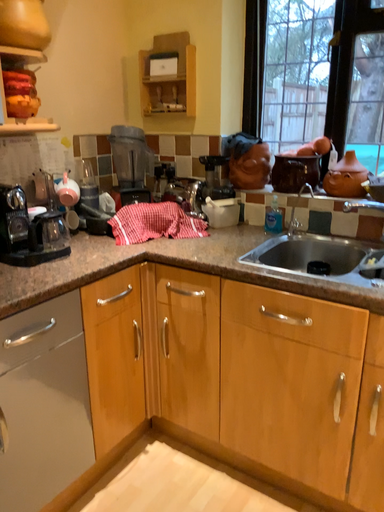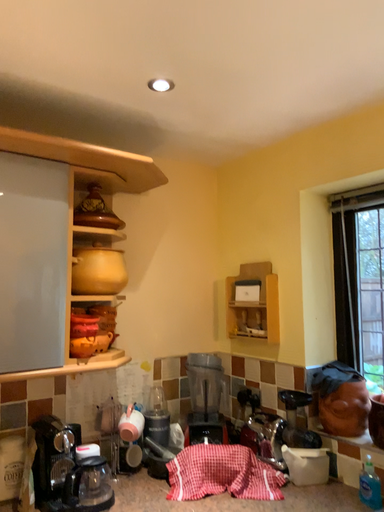
Question: How did the camera likely rotate when shooting the video?

Choices:
 (A) rotated downward
 (B) rotated upward

Answer: (B)